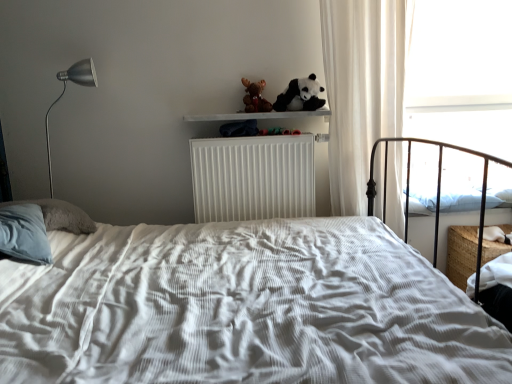
Question: Is transparent glass window at upper right taller or shorter than white sheer curtain at right?

Choices:
 (A) short
 (B) tall

Answer: (A)

Question: In terms of size, does transparent glass window at upper right appear bigger or smaller than white sheer curtain at right?

Choices:
 (A) small
 (B) big

Answer: (A)

Question: Which object is positioned closest to the brown plush moose at upper center?

Choices:
 (A) white ribbed radiator at center
 (B) transparent glass window at upper right
 (C) white soft pillow at right
 (D) white textured bed at center
 (E) soft plush panda at upper center

Answer: (E)

Question: Estimate the real-world distances between objects in this image. Which object is farther from the white wooden shelf at upper center?

Choices:
 (A) white ribbed radiator at center
 (B) transparent glass window at upper right
 (C) white sheer curtain at right
 (D) white textured bed at center
 (E) white soft pillow at right

Answer: (B)